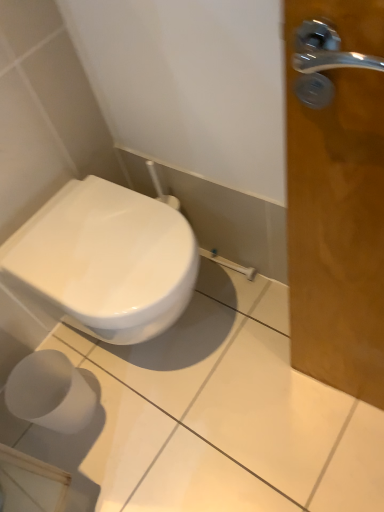
At what (x,y) coordinates should I click in order to perform the action: click on free point above white glossy toilet at lower left (from a real-world perspective). Please return your answer as a coordinate pair (x, y). Looking at the image, I should click on (100, 237).